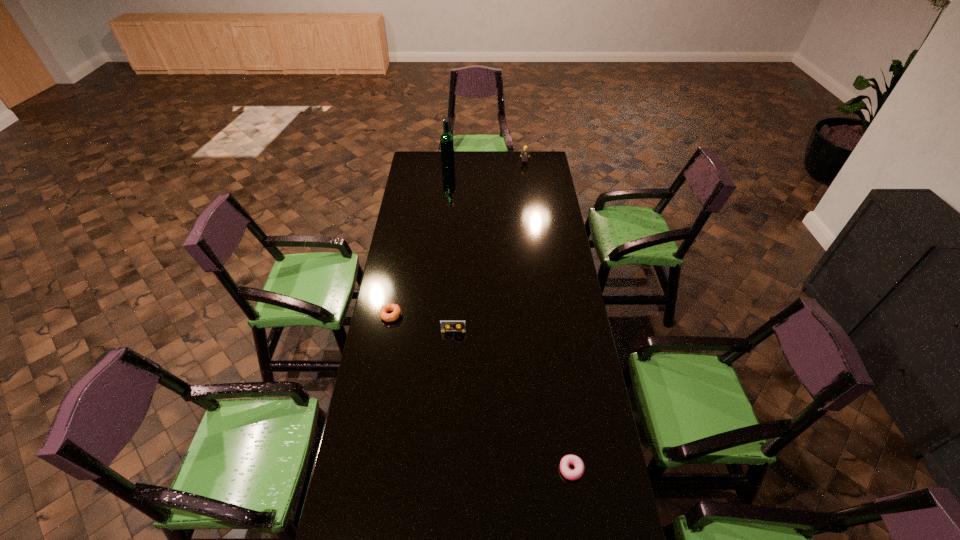
Locate an element on the screen. The width and height of the screenshot is (960, 540). vacant area at the left edge of the desktop is located at coordinates (426, 225).

Where is `free spot at the right edge of the desktop`? This screenshot has height=540, width=960. free spot at the right edge of the desktop is located at coordinates (554, 386).

Where is `free space at the far right corner`? The image size is (960, 540). free space at the far right corner is located at coordinates (548, 159).

Locate an element on the screen. This screenshot has height=540, width=960. unoccupied area between the fourth shortest object and the shorter doughnut is located at coordinates (548, 315).

At what (x,y) coordinates should I click in order to perform the action: click on free space between the fourth tallest object and the third tallest object. Please return your answer as a coordinate pair (x, y). Looking at the image, I should click on (422, 323).

Identify the location of free point between the second nearest object and the tallest object. (451, 248).

Identify the location of free space between the taller doughnut and the fourth shortest object. This screenshot has width=960, height=540. (458, 238).

The image size is (960, 540). Identify the location of unoccupied area between the tallest object and the third tallest object. (451, 248).

Locate an element on the screen. vacant point located between the beer bottle and the shortest object is located at coordinates (510, 317).

Locate an element on the screen. vacant space that's between the fourth shortest object and the second nearest object is located at coordinates (489, 246).